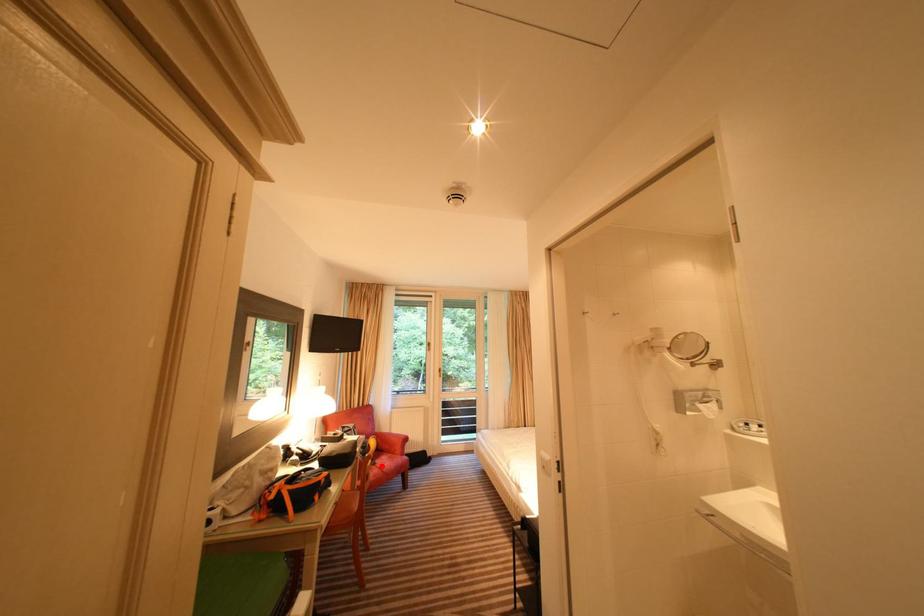
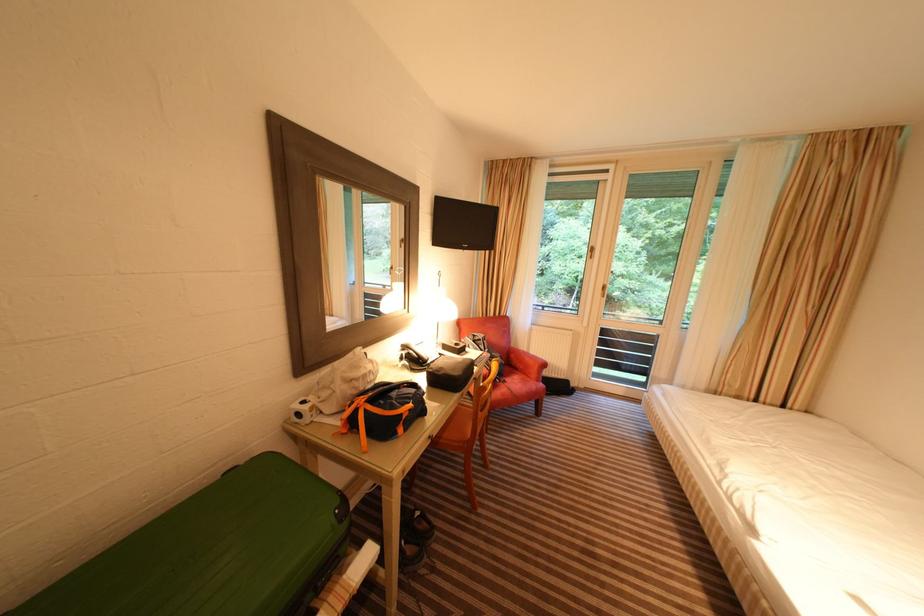
Question: I am providing you with two images of the same scene from different viewpoints. Image1 has a red point marked. In image2, the corresponding 3D location appears at what relative position? Reply with the corresponding letter.

Choices:
 (A) Closer
 (B) Farther

Answer: (B)